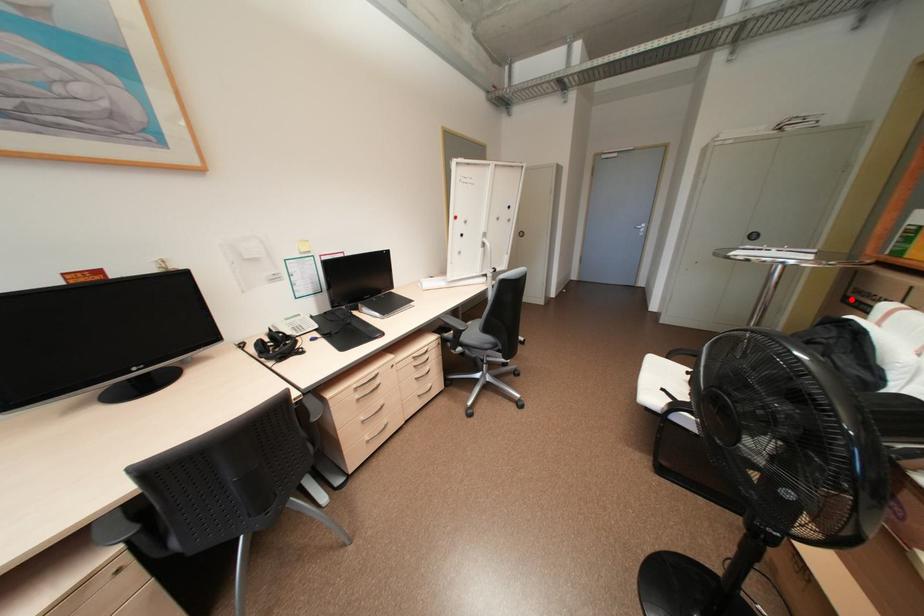
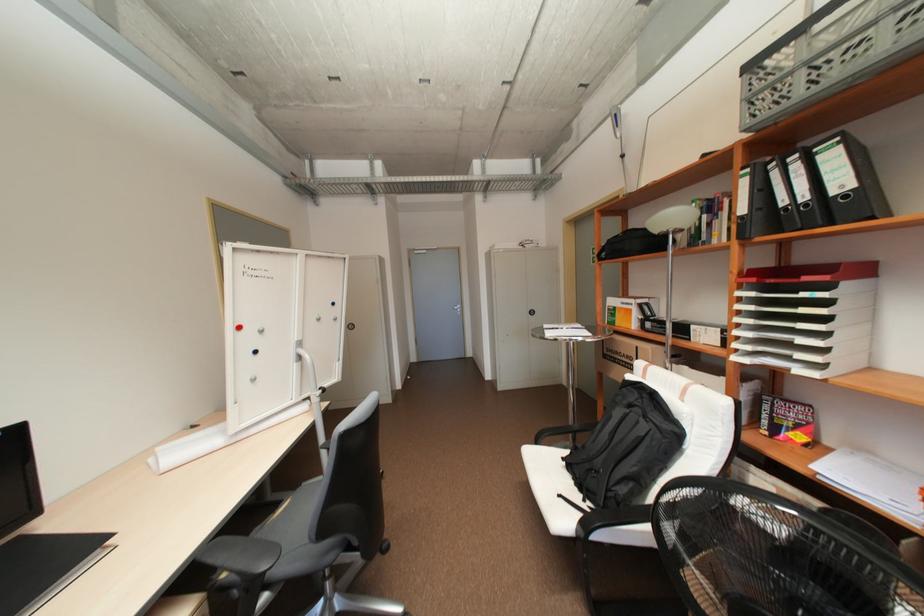
The point at the highlighted location is marked in the first image. Where is the corresponding point in the second image?

(611, 355)